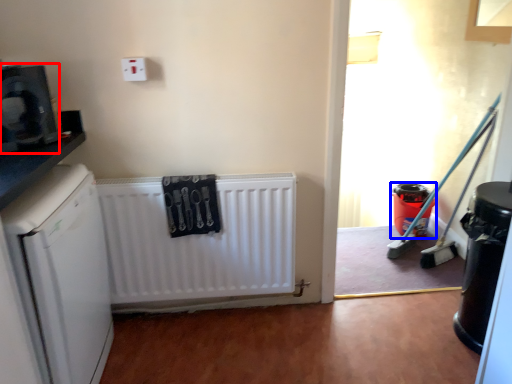
Question: Among these objects, which one is nearest to the camera, appliance (highlighted by a red box) or appliance (highlighted by a blue box)?

Choices:
 (A) appliance
 (B) appliance

Answer: (A)